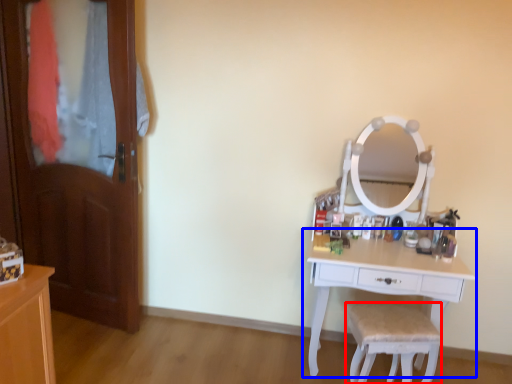
Question: Which point is closer to the camera, chair (highlighted by a red box) or table (highlighted by a blue box)?

Choices:
 (A) chair
 (B) table

Answer: (A)